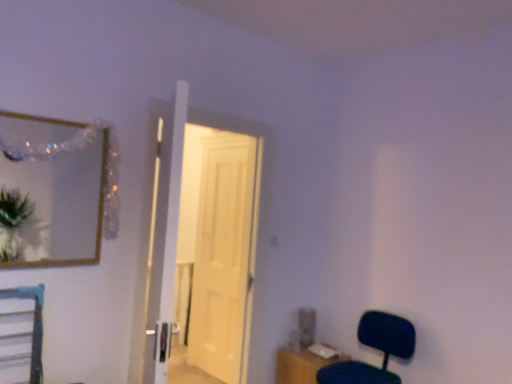
I want to click on wooden table at lower right, so click(x=301, y=365).

Locate an element on the screen. The image size is (512, 384). wooden frame mirror at upper left is located at coordinates (61, 205).

Which is in front, point (69, 177) or point (288, 373)?

The point (69, 177) is more forward.

Is wooden frame mirror at upper left inside or outside of wooden table at lower right?

wooden frame mirror at upper left cannot be found inside wooden table at lower right.

Between wooden frame mirror at upper left and wooden table at lower right, which one appears on the right side from the viewer's perspective?

wooden table at lower right is more to the right.

At what (x,y) coordinates should I click in order to perform the action: click on table below the wooden frame mirror at upper left (from the image's perspective). Please return your answer as a coordinate pair (x, y). This screenshot has height=384, width=512. Looking at the image, I should click on (301, 365).

Which is behind, point (188, 181) or point (394, 315)?

The point (188, 181) is more distant.

Measure the distance between white wooden door at center, which appears as the first door when viewed from the front, and matte black chair at lower right.

3.83 feet.

From the image's perspective, which is above, white wooden door at center, the second door from the back, or matte black chair at lower right?

white wooden door at center, the second door from the back.

Is white wooden door at center, which appears as the first door when viewed from the front, looking in the opposite direction of matte black chair at lower right?

white wooden door at center, which appears as the first door when viewed from the front, does not have its back to matte black chair at lower right.

Is wooden frame mirror at upper left at the right side of white glossy door at center, which ranks as the 1th door in back-to-front order?

In fact, wooden frame mirror at upper left is to the left of white glossy door at center, which ranks as the 1th door in back-to-front order.

Considering the positions of point (101, 188) and point (233, 239), is point (101, 188) closer or farther from the camera than point (233, 239)?

Point (101, 188).

Which object is wider, wooden frame mirror at upper left or white glossy door at center, which ranks as the 1th door in back-to-front order?

Wider between the two is wooden frame mirror at upper left.

Is point (228, 238) more distant than point (173, 196)?

Yes, it is behind point (173, 196).

Between white glossy door at center, which ranks as the 1th door in back-to-front order, and white wooden door at center, the second door from the back, which one has larger size?

Bigger between the two is white wooden door at center, the second door from the back.

Considering the relative sizes of white glossy door at center, which ranks as the 1th door in back-to-front order, and white wooden door at center, the second door from the back, in the image provided, is white glossy door at center, which ranks as the 1th door in back-to-front order, thinner than white wooden door at center, the second door from the back,?

Indeed, white glossy door at center, which ranks as the 1th door in back-to-front order, has a lesser width compared to white wooden door at center, the second door from the back.

Could you tell me if matte black chair at lower right is turned towards white glossy door at center, the 2th door positioned from the front?

No, matte black chair at lower right is not aimed at white glossy door at center, the 2th door positioned from the front.

Visually, is matte black chair at lower right positioned to the left or to the right of white glossy door at center, the 2th door positioned from the front?

Clearly, matte black chair at lower right is on the right of white glossy door at center, the 2th door positioned from the front, in the image.

Is point (336, 374) in front of point (214, 136)?

Yes, point (336, 374) is closer to viewer.

Is matte black chair at lower right positioned beyond the bounds of white glossy door at center, the 2th door positioned from the front?

Yes, matte black chair at lower right is outside of white glossy door at center, the 2th door positioned from the front.

Consider the image. Can you confirm if wooden table at lower right is thinner than white glossy door at center, the 2th door positioned from the front?

No, wooden table at lower right is not thinner than white glossy door at center, the 2th door positioned from the front.

Considering the sizes of objects wooden table at lower right and white glossy door at center, which ranks as the 1th door in back-to-front order, in the image provided, who is taller, wooden table at lower right or white glossy door at center, which ranks as the 1th door in back-to-front order,?

white glossy door at center, which ranks as the 1th door in back-to-front order.

Considering the positions of objects wooden table at lower right and white glossy door at center, which ranks as the 1th door in back-to-front order, in the image provided, who is behind, wooden table at lower right or white glossy door at center, which ranks as the 1th door in back-to-front order,?

Positioned behind is white glossy door at center, which ranks as the 1th door in back-to-front order.

Is matte black chair at lower right turned away from wooden table at lower right?

matte black chair at lower right does not have its back to wooden table at lower right.

Can wooden table at lower right be found inside matte black chair at lower right?

No, wooden table at lower right is not inside matte black chair at lower right.

From the image's perspective, is matte black chair at lower right located beneath wooden table at lower right?

No.

In terms of width, does matte black chair at lower right look wider or thinner when compared to wooden table at lower right?

matte black chair at lower right is wider than wooden table at lower right.

This screenshot has height=384, width=512. I want to click on table that appears behind the wooden frame mirror at upper left, so point(301,365).

Locate an element on the screen. chair lying on the right of white wooden door at center, which appears as the first door when viewed from the front is located at coordinates (374, 348).

Based on their spatial positions, is white wooden door at center, which appears as the first door when viewed from the front, or wooden frame mirror at upper left further from matte black chair at lower right?

wooden frame mirror at upper left.

Looking at the image, which one is located closer to wooden table at lower right, matte black chair at lower right or white glossy door at center, which ranks as the 1th door in back-to-front order?

matte black chair at lower right lies closer to wooden table at lower right than the other object.

Considering their positions, is wooden frame mirror at upper left positioned closer to wooden table at lower right than white glossy door at center, which ranks as the 1th door in back-to-front order?

Based on the image, white glossy door at center, which ranks as the 1th door in back-to-front order, appears to be nearer to wooden table at lower right.

Which object lies further to the anchor point matte black chair at lower right, white wooden door at center, the second door from the back, or wooden table at lower right?

white wooden door at center, the second door from the back, lies further to matte black chair at lower right than the other object.

Considering their positions, is wooden frame mirror at upper left positioned closer to white wooden door at center, the second door from the back, than wooden table at lower right?

wooden table at lower right.

Looking at the image, which one is located closer to white glossy door at center, the 2th door positioned from the front, wooden table at lower right or wooden frame mirror at upper left?

wooden table at lower right is closer to white glossy door at center, the 2th door positioned from the front.

Estimate the real-world distances between objects in this image. Which object is closer to white wooden door at center, which appears as the first door when viewed from the front, white glossy door at center, which ranks as the 1th door in back-to-front order, or matte black chair at lower right?

The object closer to white wooden door at center, which appears as the first door when viewed from the front, is white glossy door at center, which ranks as the 1th door in back-to-front order.

Based on their spatial positions, is white glossy door at center, the 2th door positioned from the front, or matte black chair at lower right closer to wooden table at lower right?

matte black chair at lower right lies closer to wooden table at lower right than the other object.

Identify the location of table between wooden frame mirror at upper left and matte black chair at lower right. Image resolution: width=512 pixels, height=384 pixels. (301, 365).

Locate an element on the screen. The width and height of the screenshot is (512, 384). table between wooden frame mirror at upper left and white glossy door at center, the 2th door positioned from the front, along the z-axis is located at coordinates (301, 365).

I want to click on table located between matte black chair at lower right and white glossy door at center, which ranks as the 1th door in back-to-front order, in the depth direction, so click(x=301, y=365).

Locate an element on the screen. The height and width of the screenshot is (384, 512). table positioned between white wooden door at center, the second door from the back, and white glossy door at center, the 2th door positioned from the front, from near to far is located at coordinates (301, 365).